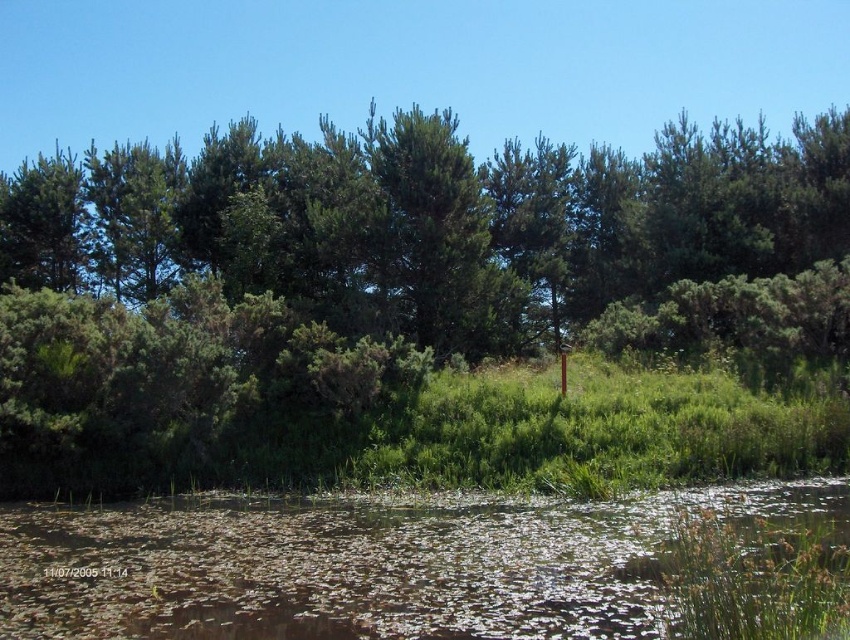
You are standing at the edge of the water in this serene natural scene. You want to take a photo that includes both the green leafy tree at center and the translucent murky water at lower center. Which object should appear closer to the camera in your photo?

The green leafy tree at center should appear closer to the camera because the translucent murky water at lower center is positioned behind it.

You are standing at the center of the image and want to locate the green leafy tree at center. According to the coordinates provided, where exactly is it positioned?

The green leafy tree at center is positioned at coordinates point [411,304].